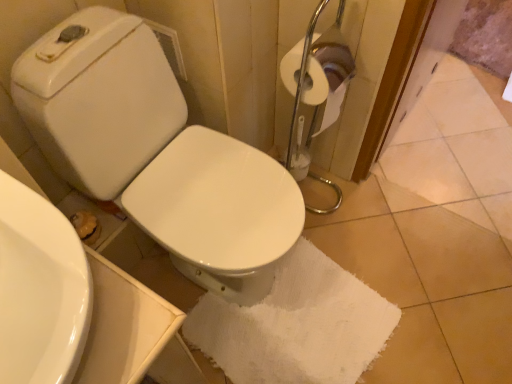
Question: Is white glossy toilet at center inside or outside of white glossy sink at lower left?

Choices:
 (A) outside
 (B) inside

Answer: (A)

Question: Is white glossy toilet at center taller or shorter than white glossy sink at lower left?

Choices:
 (A) short
 (B) tall

Answer: (B)

Question: Which object is positioned farthest from the white glossy toilet at center?

Choices:
 (A) white cotton bath towel at center
 (B) white glossy sink at lower left

Answer: (A)

Question: Estimate the real-world distances between objects in this image. Which object is farther from the white cotton bath towel at center?

Choices:
 (A) white glossy toilet at center
 (B) white glossy sink at lower left

Answer: (B)